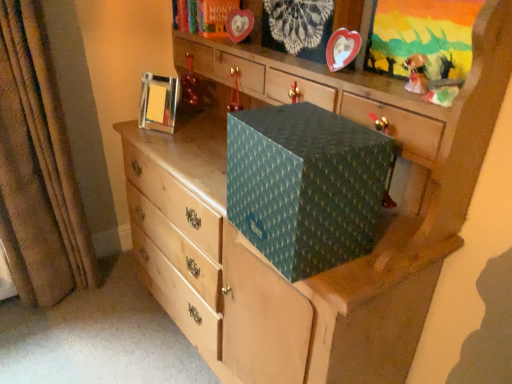
Question: Is metallic silver picture frame at upper left, which is counted as the second picture frame, starting from the front, outside metallic red ornament at upper center, placed as the first toy when sorted from back to front?

Choices:
 (A) yes
 (B) no

Answer: (A)

Question: Does metallic silver picture frame at upper left, the second picture frame from the right, turn towards metallic red ornament at upper center, placed as the first toy when sorted from back to front?

Choices:
 (A) yes
 (B) no

Answer: (B)

Question: Considering the relative positions of metallic silver picture frame at upper left, which is counted as the second picture frame, starting from the front, and metallic red ornament at upper center, placed as the second toy when sorted from bottom to top, in the image provided, is metallic silver picture frame at upper left, which is counted as the second picture frame, starting from the front, to the left of metallic red ornament at upper center, placed as the second toy when sorted from bottom to top, from the viewer's perspective?

Choices:
 (A) yes
 (B) no

Answer: (A)

Question: Can you confirm if metallic silver picture frame at upper left, the second picture frame from the right, is positioned to the right of metallic red ornament at upper center, placed as the second toy when sorted from bottom to top?

Choices:
 (A) yes
 (B) no

Answer: (B)

Question: Is metallic silver picture frame at upper left, which is the first picture frame in back-to-front order, shorter than metallic red ornament at upper center, the 1th toy positioned from the left?

Choices:
 (A) no
 (B) yes

Answer: (A)

Question: From their relative heights in the image, would you say brown textured curtain at left is taller or shorter than metallic heart-shaped frame at upper center, which appears as the 1th picture frame when viewed from the front?

Choices:
 (A) short
 (B) tall

Answer: (B)

Question: Do you think brown textured curtain at left is within metallic heart-shaped frame at upper center, the first picture frame viewed from the right, or outside of it?

Choices:
 (A) outside
 (B) inside

Answer: (A)

Question: Is point (23, 31) positioned closer to the camera than point (328, 51)?

Choices:
 (A) closer
 (B) farther

Answer: (B)

Question: From a real-world perspective, relative to metallic heart-shaped frame at upper center, positioned as the second picture frame in back-to-front order, is brown textured curtain at left vertically above or below?

Choices:
 (A) below
 (B) above

Answer: (A)

Question: Visually, is teal textured box at center positioned to the left or to the right of metallic silver picture frame at upper left, the second picture frame from the right?

Choices:
 (A) right
 (B) left

Answer: (A)

Question: Considering the positions of teal textured box at center and metallic silver picture frame at upper left, which is the first picture frame in back-to-front order, in the image, is teal textured box at center taller or shorter than metallic silver picture frame at upper left, which is the first picture frame in back-to-front order,?

Choices:
 (A) tall
 (B) short

Answer: (A)

Question: Relative to metallic silver picture frame at upper left, which is counted as the second picture frame, starting from the front, is teal textured box at center in front or behind?

Choices:
 (A) behind
 (B) front

Answer: (B)

Question: Which is correct: teal textured box at center is inside metallic silver picture frame at upper left, the second picture frame from the right, or outside of it?

Choices:
 (A) inside
 (B) outside

Answer: (B)

Question: In terms of height, does metallic silver picture frame at upper left, the 1th picture frame positioned from the left, look taller or shorter compared to teal textured box at center?

Choices:
 (A) short
 (B) tall

Answer: (A)

Question: In terms of width, does metallic silver picture frame at upper left, the 1th picture frame positioned from the left, look wider or thinner when compared to teal textured box at center?

Choices:
 (A) thin
 (B) wide

Answer: (A)